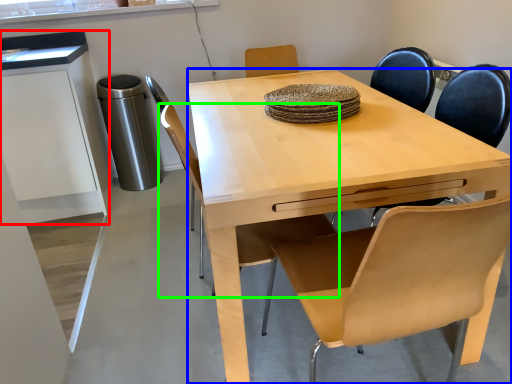
Question: Based on their relative distances, which object is nearer to cabinetry (highlighted by a red box)? Choose from desk (highlighted by a blue box) and chair (highlighted by a green box).

Choices:
 (A) desk
 (B) chair

Answer: (A)